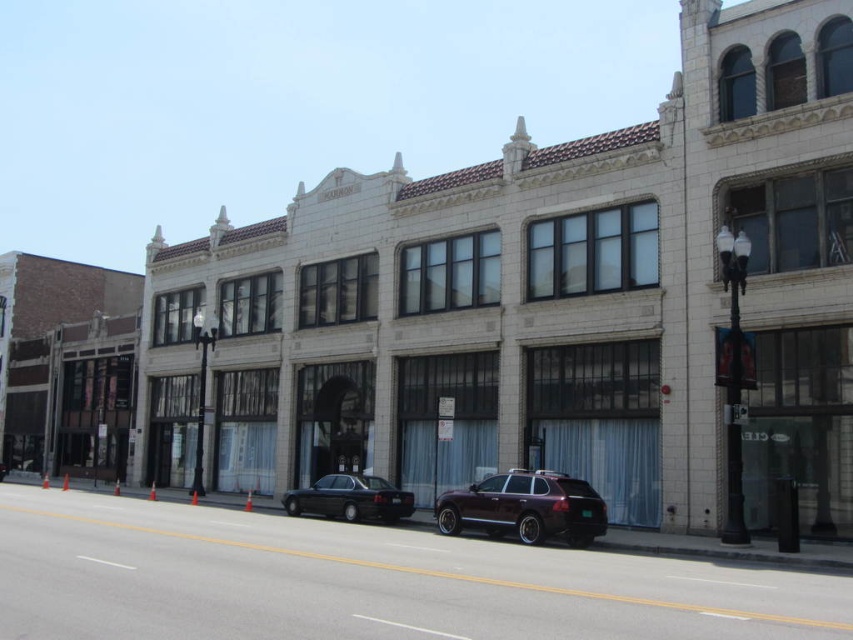
Question: Is satin burgundy suv at center smaller than shiny black sedan at center?

Choices:
 (A) yes
 (B) no

Answer: (A)

Question: Is satin burgundy suv at center positioned behind shiny black sedan at center?

Choices:
 (A) yes
 (B) no

Answer: (B)

Question: Among these objects, which one is nearest to the camera?

Choices:
 (A) satin burgundy suv at center
 (B) shiny black sedan at center

Answer: (A)

Question: Is satin burgundy suv at center closer to the viewer compared to shiny black sedan at center?

Choices:
 (A) yes
 (B) no

Answer: (A)